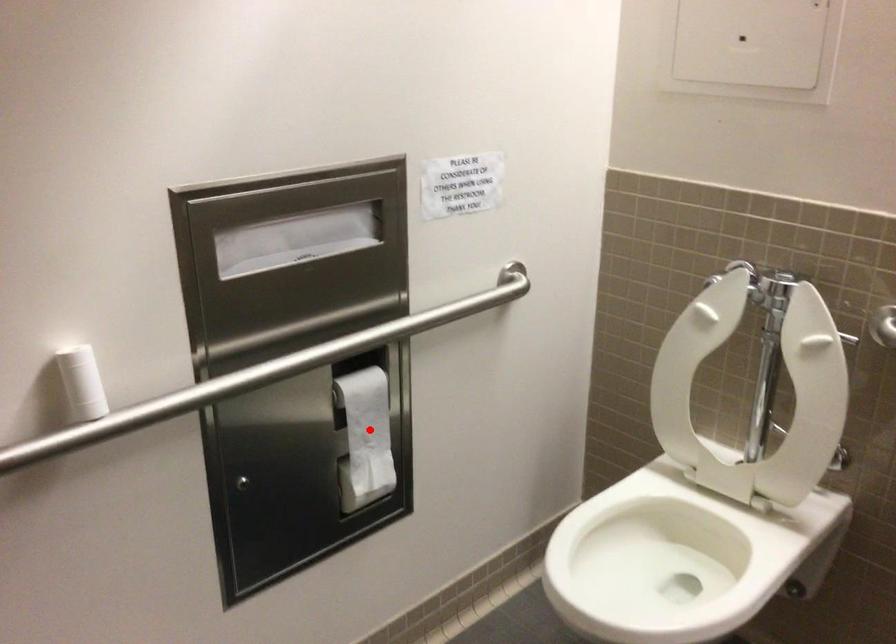
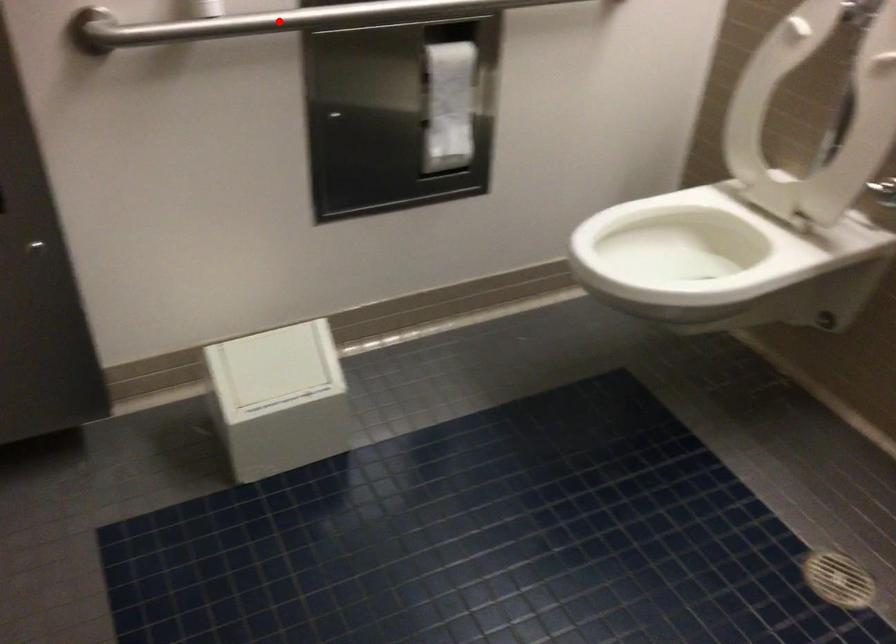
I am providing you with two images of the same scene from different viewpoints. A red point is marked on the first image and another point is marked on the second image. Does the point marked in image1 correspond to the same location as the one in image2?

No